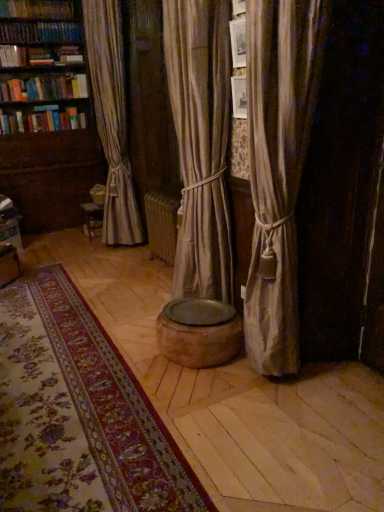
Locate an element on the screen. free space on the front side of silky beige curtain at right is located at coordinates (296, 421).